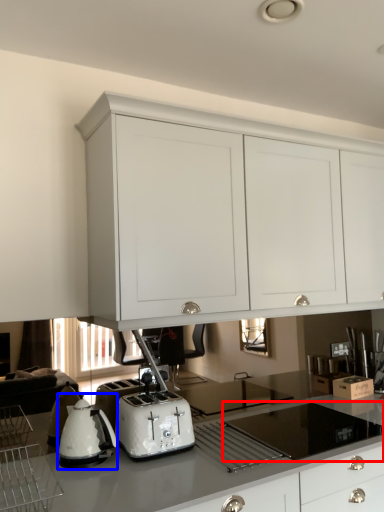
Question: Among these objects, which one is farthest to the camera, gas stove (highlighted by a red box) or home appliance (highlighted by a blue box)?

Choices:
 (A) gas stove
 (B) home appliance

Answer: (B)